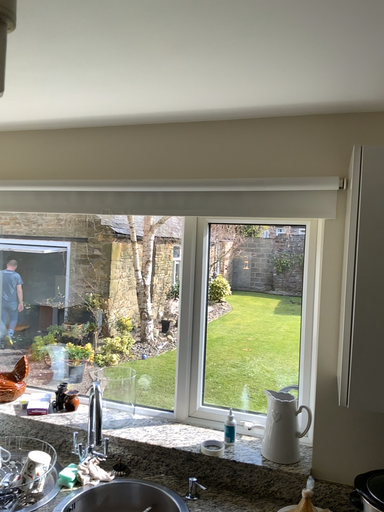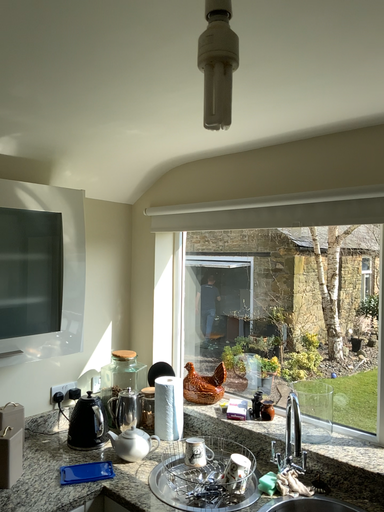
Question: Which way did the camera rotate in the video?

Choices:
 (A) rotated right
 (B) rotated left

Answer: (B)